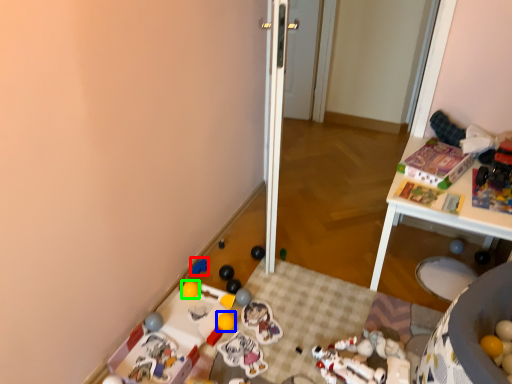
Question: Considering the real-world distances, which object is farthest from toy (highlighted by a red box)? toy (highlighted by a blue box) or toy (highlighted by a green box)?

Choices:
 (A) toy
 (B) toy

Answer: (A)